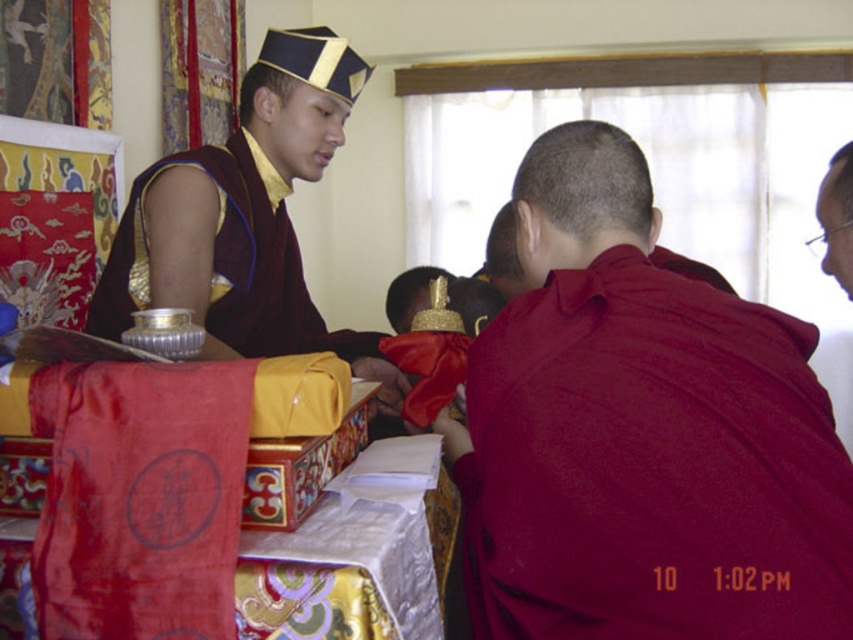
Between smooth maroon robe at center and smooth red robe at right, which one is positioned lower?

smooth maroon robe at center is lower down.

The width and height of the screenshot is (853, 640). Find the location of `smooth maroon robe at center`. smooth maroon robe at center is located at coordinates (641, 435).

Which of these two, silky red cloth at lower center or smooth red robe at right, stands shorter?

smooth red robe at right

Which is more to the left, silky red cloth at lower center or smooth red robe at right?

silky red cloth at lower center

Who is more forward, (259, 556) or (848, 292)?

Point (259, 556) is more forward.

You are a GUI agent. You are given a task and a screenshot of the screen. Output one action in this format:
    pyautogui.click(x=<x>, y=<y>)
    Task: Click on the silky red cloth at lower center
    The width and height of the screenshot is (853, 640).
    Given the screenshot: What is the action you would take?
    pyautogui.click(x=178, y=506)

The image size is (853, 640). Describe the element at coordinates (641, 435) in the screenshot. I see `smooth maroon robe at center` at that location.

Does smooth maroon robe at center appear under maroon silk robe at center?

Indeed, smooth maroon robe at center is positioned under maroon silk robe at center.

Where is `smooth maroon robe at center`? Image resolution: width=853 pixels, height=640 pixels. smooth maroon robe at center is located at coordinates (641, 435).